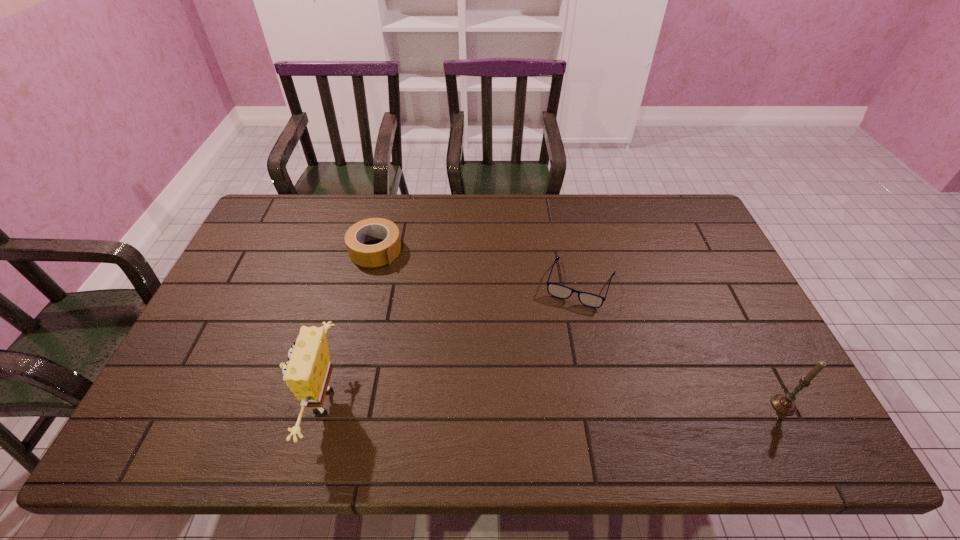
Locate an element on the screen. The width and height of the screenshot is (960, 540). free point located on the front-facing side of the spectacles is located at coordinates (557, 355).

Find the location of a particular element. free space located on the front-facing side of the spectacles is located at coordinates (558, 353).

Where is `free space located on the front-facing side of the spectacles`? free space located on the front-facing side of the spectacles is located at coordinates (566, 325).

Identify the location of vacant area situated 0.260m at the edge of the duct tape. This screenshot has width=960, height=540. (442, 310).

The image size is (960, 540). I want to click on vacant space located at the edge of the duct tape, so click(x=417, y=287).

The height and width of the screenshot is (540, 960). I want to click on vacant area situated 0.180m at the edge of the duct tape, so click(424, 295).

Identify the location of object located at the far edge. The image size is (960, 540). (380, 254).

What are the coordinates of `sponge at the near edge` in the screenshot? It's located at (307, 373).

The image size is (960, 540). What are the coordinates of `candle that is at the near edge` in the screenshot? It's located at (784, 404).

Image resolution: width=960 pixels, height=540 pixels. I want to click on object at the right edge, so click(x=784, y=404).